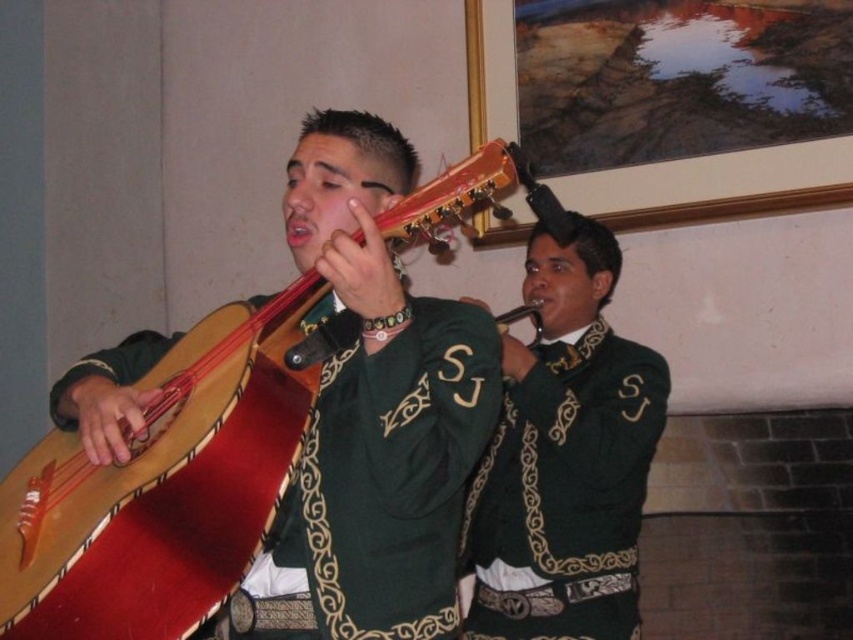
You are standing in the room where the mariachi musicians are performing. You notice two points marked on the floor. The first point is at coordinate point(x=279, y=365) and the second is at point(x=613, y=556). If you want to move closer to the front of the stage, which point should you step on?

You should step on point(x=279, y=365) because it is in front of point(x=613, y=556), meaning it is closer to the front of the stage.

You are organizing a mariachi performance and need to ensure the performers have enough space to move. The green velvet vest at center is worn by the guitarron player, and the green matte jacket at center is worn by the trumpet player. Which performer has a wider garment that might require more space?

The green matte jacket at center is wider than the green velvet vest at center, so the trumpet player wearing the green matte jacket at center requires more space.